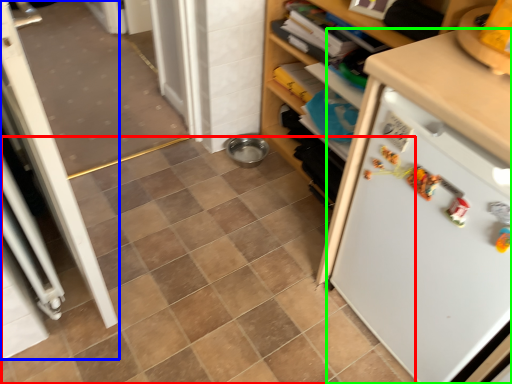
Question: Estimate the real-world distances between objects in this image. Which object is farther from ceramic tile (highlighted by a red box), screen door (highlighted by a blue box) or refrigerator (highlighted by a green box)?

Choices:
 (A) screen door
 (B) refrigerator

Answer: (B)